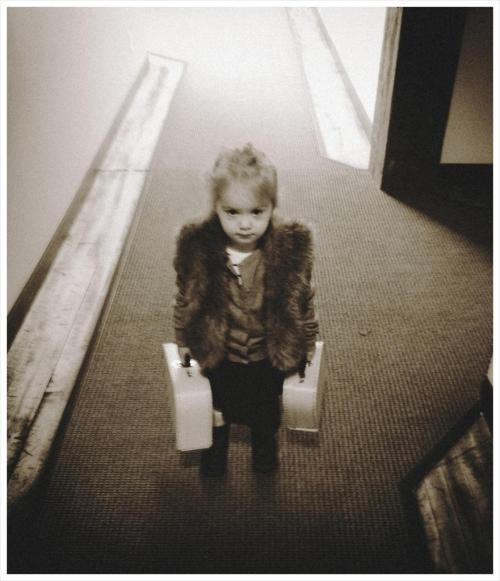
Find the location of `bump in carpet`. bump in carpet is located at coordinates (366, 332).